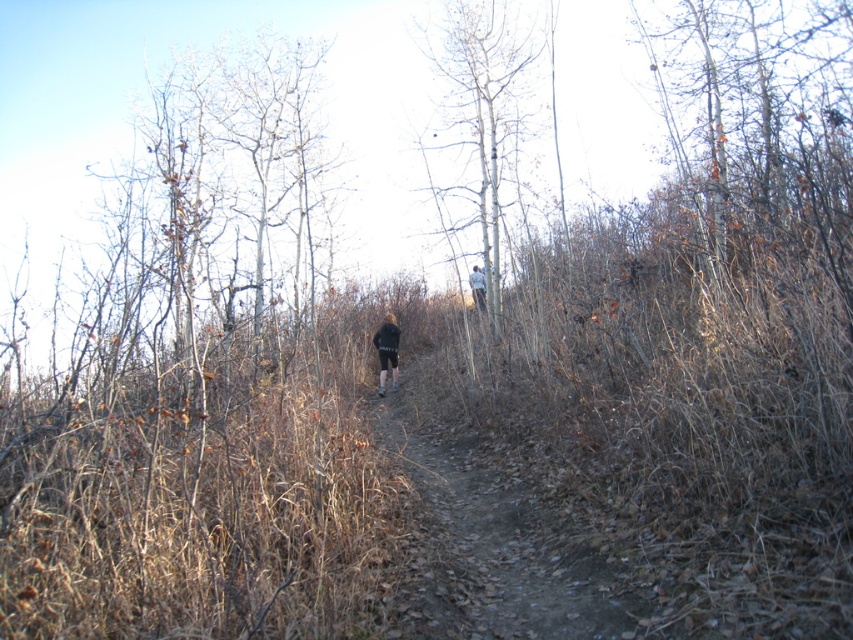
Question: Observing the image, what is the correct spatial positioning of smooth white tree at upper center in reference to light blue denim jacket at upper center?

Choices:
 (A) above
 (B) below

Answer: (A)

Question: Which of these objects is positioned farthest from the dirt path at center?

Choices:
 (A) smooth white tree at upper center
 (B) dark gray fabric jacket at center

Answer: (A)

Question: Is dirt path at center in front of light blue denim jacket at upper center?

Choices:
 (A) yes
 (B) no

Answer: (A)

Question: Is smooth white tree at upper center thinner than light blue denim jacket at upper center?

Choices:
 (A) no
 (B) yes

Answer: (A)

Question: Which point is closer to the camera taking this photo?

Choices:
 (A) [x=375, y=333]
 (B) [x=432, y=595]

Answer: (B)

Question: Which object is the closest to the smooth white tree at upper center?

Choices:
 (A) dark gray fabric jacket at center
 (B) light blue denim jacket at upper center
 (C) dirt path at center

Answer: (B)